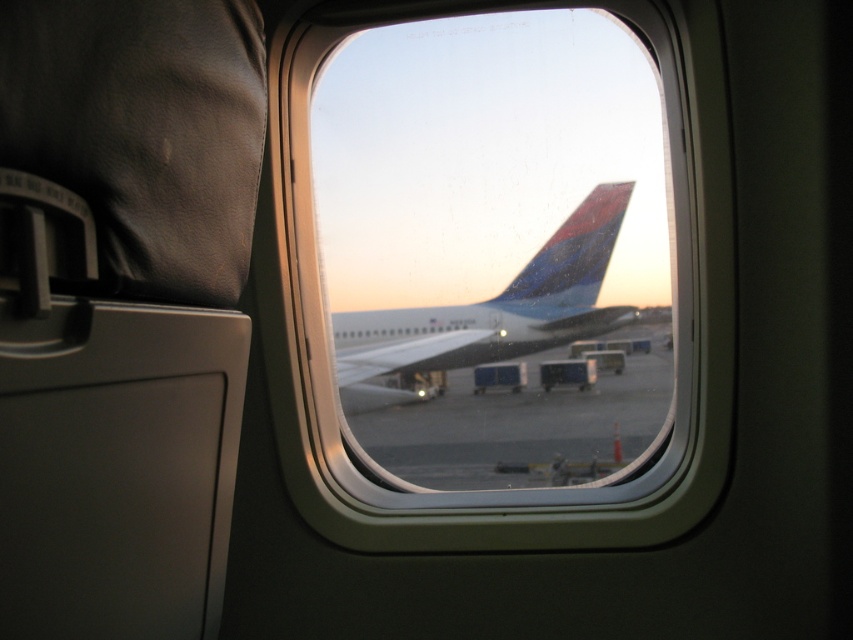
Question: Which object is the farthest from the transparent glass airplane window at center?

Choices:
 (A) smooth concrete tarmac at center
 (B) metallic blue airplane at center

Answer: (B)

Question: Observing the image, what is the correct spatial positioning of smooth concrete tarmac at center in reference to metallic blue airplane at center?

Choices:
 (A) above
 (B) below

Answer: (B)

Question: Is smooth concrete tarmac at center below metallic blue airplane at center?

Choices:
 (A) no
 (B) yes

Answer: (B)

Question: Among these points, which one is nearest to the camera?

Choices:
 (A) (322, 449)
 (B) (585, 426)
 (C) (469, 340)

Answer: (A)

Question: Among these points, which one is farthest from the camera?

Choices:
 (A) (474, 468)
 (B) (374, 86)

Answer: (A)

Question: Can you confirm if transparent glass airplane window at center is positioned above metallic blue airplane at center?

Choices:
 (A) no
 (B) yes

Answer: (B)